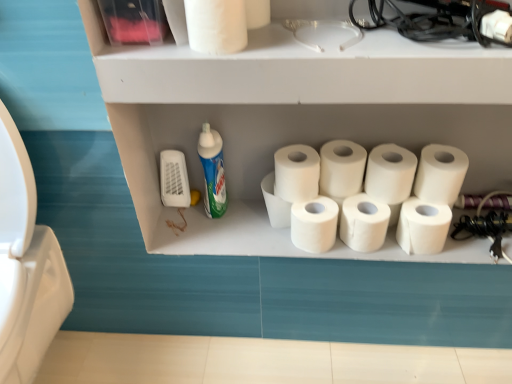
Identify the location of free point to the right of white matte toilet paper at upper center, the 2th toilet paper positioned from the left. This screenshot has height=384, width=512. (333, 23).